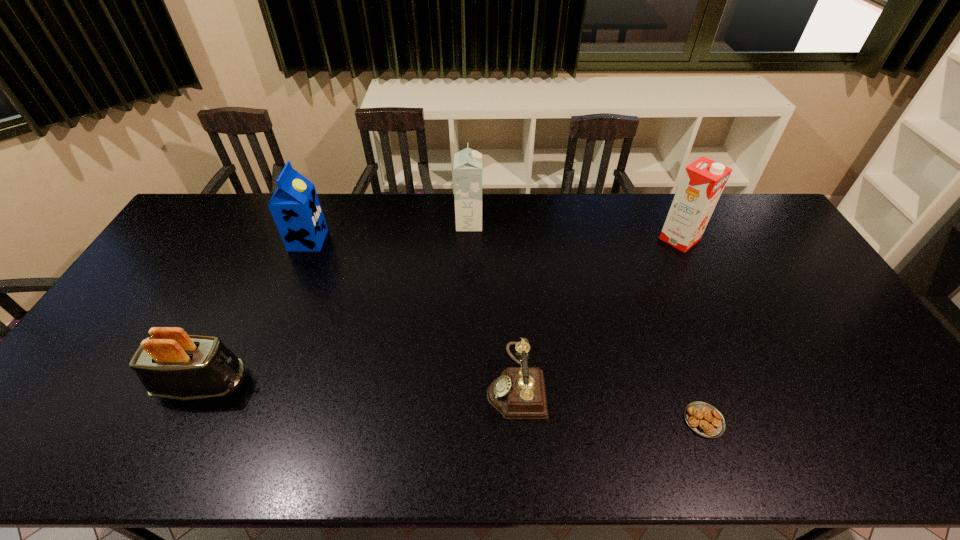
At what (x,y) coordinates should I click in order to perform the action: click on free region at the right edge of the desktop. Please return your answer as a coordinate pair (x, y). The image size is (960, 540). Looking at the image, I should click on (770, 272).

In the image, there is a desktop. Where is `free space at the far left corner`? free space at the far left corner is located at coordinates [x=181, y=233].

Identify the location of free point between the toaster and the fourth object from left to right. This screenshot has width=960, height=540. (359, 383).

You are a GUI agent. You are given a task and a screenshot of the screen. Output one action in this format:
    pyautogui.click(x=<x>, y=<y>)
    Task: Click on the blank region between the rightmost carton and the toaster
    Image resolution: width=960 pixels, height=540 pixels.
    Given the screenshot: What is the action you would take?
    pyautogui.click(x=442, y=312)

This screenshot has height=540, width=960. I want to click on vacant region between the rightmost carton and the third object from left to right, so click(574, 231).

What are the coordinates of `empty space between the toaster and the leftmost carton` in the screenshot? It's located at (255, 313).

Identify the location of free space between the rightmost object and the telephone. This screenshot has height=540, width=960. (597, 310).

Where is `empty location between the third shortest object and the leftmost carton`? This screenshot has height=540, width=960. empty location between the third shortest object and the leftmost carton is located at coordinates (255, 313).

Image resolution: width=960 pixels, height=540 pixels. I want to click on free space between the leftmost carton and the shortest object, so click(506, 330).

Identify the location of free spot between the third shortest object and the telephone. This screenshot has width=960, height=540. (359, 383).